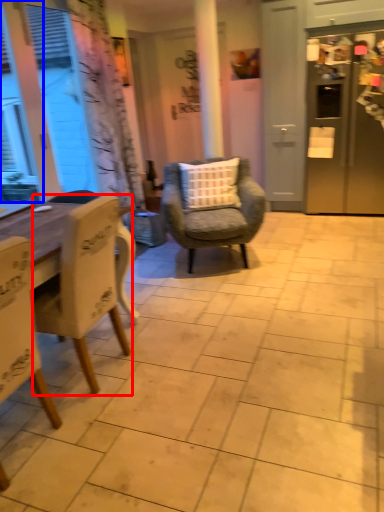
Question: Which of the following is the farthest to the observer, chair (highlighted by a red box) or window (highlighted by a blue box)?

Choices:
 (A) chair
 (B) window

Answer: (B)